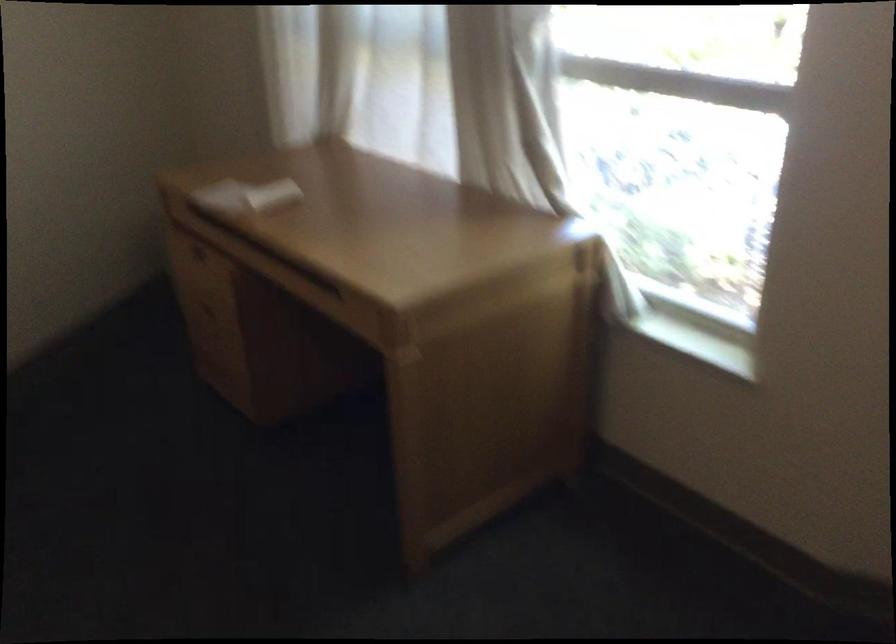
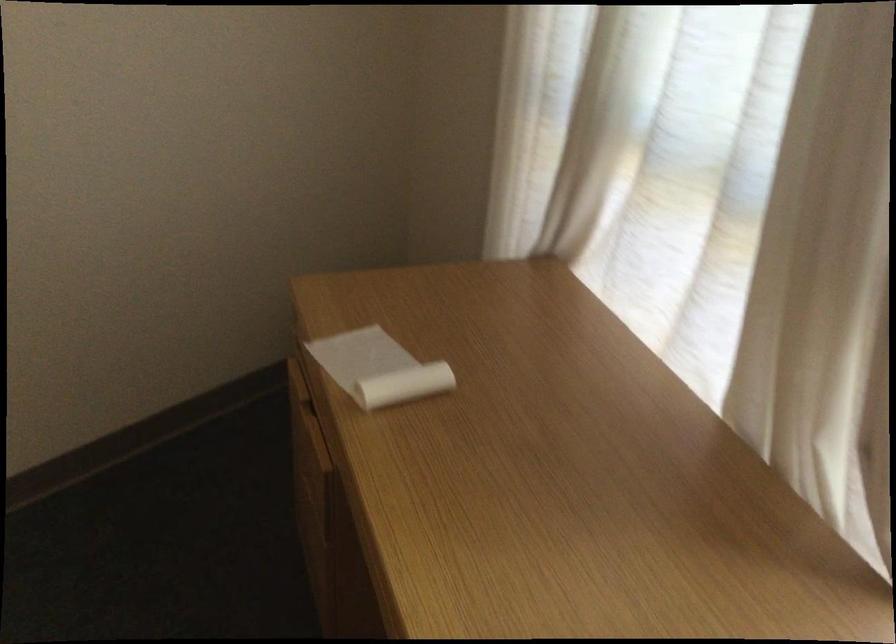
Question: The images are taken continuously from a first-person perspective. In which direction is your viewpoint rotating?

Choices:
 (A) Left
 (B) Right
 (C) Up
 (D) Down

Answer: (A)